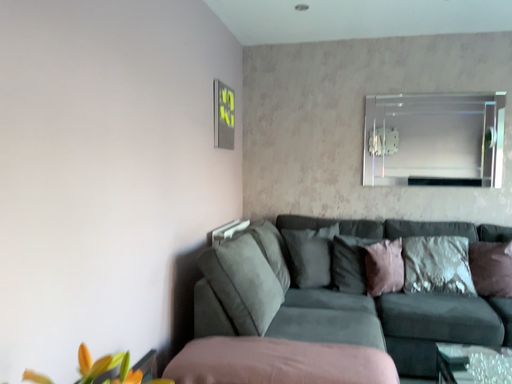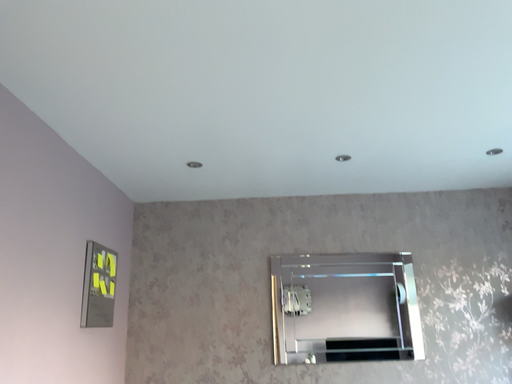
Question: Which way did the camera rotate in the video?

Choices:
 (A) rotated upward
 (B) rotated downward

Answer: (A)